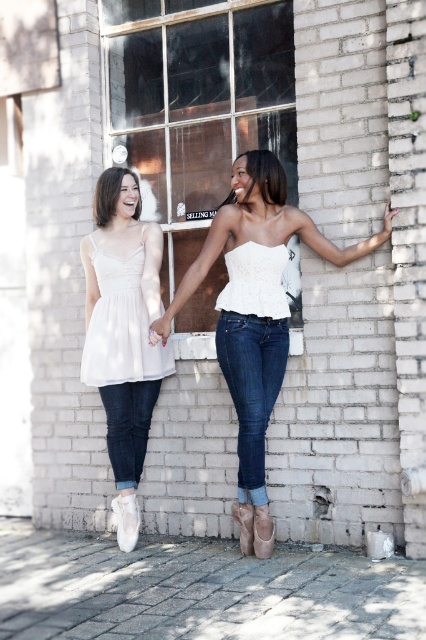
Question: Does clear glass window at center appear over white satin dress at left?

Choices:
 (A) yes
 (B) no

Answer: (A)

Question: Does clear glass window at center have a larger size compared to white lace top at center?

Choices:
 (A) yes
 (B) no

Answer: (A)

Question: Which of these objects is positioned farthest from the dark blue denim jeans at lower left?

Choices:
 (A) white lace top at center
 (B) dark blue denim jeans at center
 (C) white matte dress at left
 (D) white satin dress at left

Answer: (B)

Question: In this image, where is clear glass window at center located relative to white lace top at center?

Choices:
 (A) left
 (B) right

Answer: (A)

Question: Which object appears closest to the camera in this image?

Choices:
 (A) white satin dress at left
 (B) white lace top at center

Answer: (B)

Question: Considering the real-world distances, which object is farthest from the dark blue denim jeans at center?

Choices:
 (A) dark blue denim jeans at lower left
 (B) clear glass window at center
 (C) white lace top at center

Answer: (B)